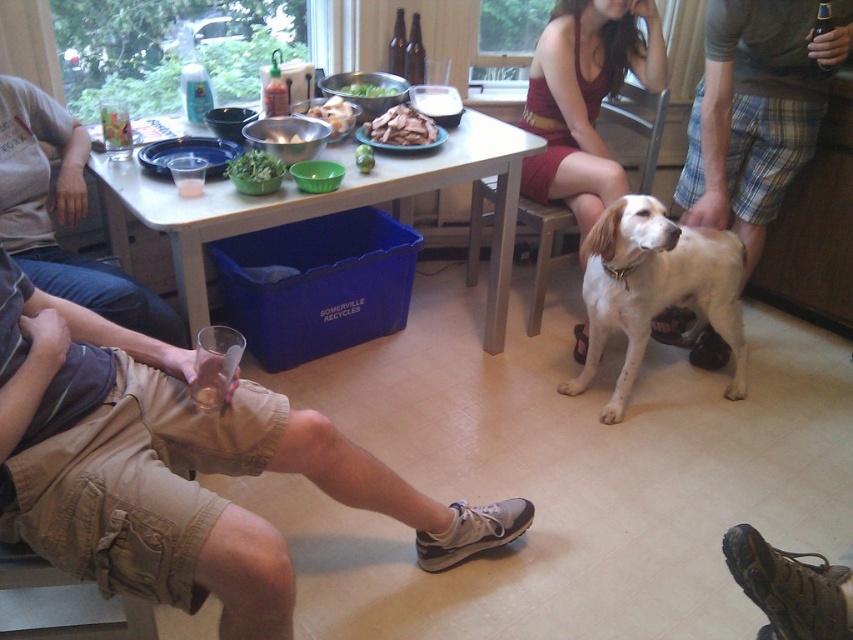
Can you confirm if tan cotton shorts at lower left is shorter than green leafy vegetable at center?

In fact, tan cotton shorts at lower left may be taller than green leafy vegetable at center.

Which is more to the right, tan cotton shorts at lower left or green leafy vegetable at center?

tan cotton shorts at lower left

Which is behind, point (262, 388) or point (241, 164)?

The point (241, 164) is behind.

Locate an element on the screen. The width and height of the screenshot is (853, 640). tan cotton shorts at lower left is located at coordinates (178, 468).

Between point (383, 90) and point (289, 129), which one is positioned in front?

Point (289, 129)

Does green leafy vegetables at center have a lesser height compared to white glossy bowl at center?

No, green leafy vegetables at center is not shorter than white glossy bowl at center.

Who is more distant from viewer, (x=357, y=84) or (x=300, y=132)?

Point (x=357, y=84)

Find the location of a particular element. green leafy vegetables at center is located at coordinates (370, 90).

Based on the photo, which of these two, maroon fabric dress at center or white glossy bowl at center, stands taller?

Standing taller between the two is maroon fabric dress at center.

The image size is (853, 640). What do you see at coordinates (584, 99) in the screenshot? I see `maroon fabric dress at center` at bounding box center [584, 99].

Is point (561, 60) behind point (273, 128)?

That is True.

What are the coordinates of `maroon fabric dress at center` in the screenshot? It's located at (584, 99).